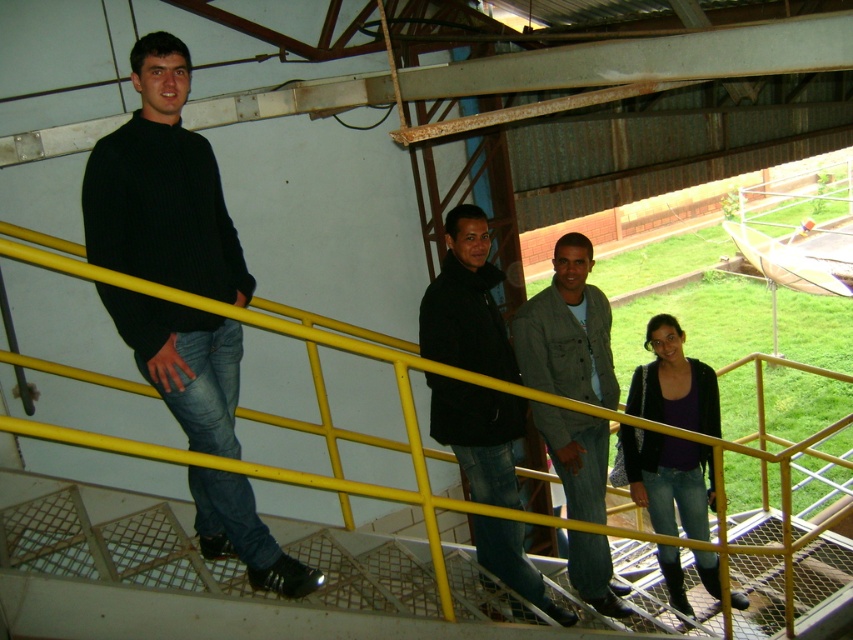
You are an inspector checking the safety of the staircase. You notice the yellow metal railing at upper left and the denim jacket at center. Which object takes up more space in the image?

The yellow metal railing at upper left is bigger than the denim jacket at center, so it takes up more space in the image.

You are an inspector standing on the staircase and need to check the yellow metal railing at upper left and denim jacket at center. Which object is located to the left of the other?

The yellow metal railing at upper left is positioned on the left side of denim jacket at center.

You are standing at the bottom of the staircase in the industrial setting. You need to locate the yellow metal railing at upper left. Based on the coordinates provided, in which direction should you look to find it?

The yellow metal railing at upper left is located at point coordinates, so you should look upward and to the left from your current position at the bottom of the staircase.